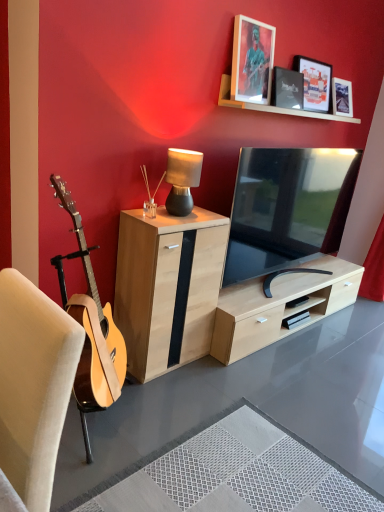
Question: Is natural wood cabinet at center spatially inside matte black picture frame at upper center, which appears as the third picture frame when viewed from the left, or outside of it?

Choices:
 (A) outside
 (B) inside

Answer: (A)

Question: Looking at their shapes, would you say natural wood cabinet at center is wider or thinner than matte black picture frame at upper center, which ranks as the 1th picture frame in right-to-left order?

Choices:
 (A) thin
 (B) wide

Answer: (B)

Question: Which is farther from the matte black tv at center?

Choices:
 (A) black matte picture frame at upper center, the 2th picture frame in the left-to-right sequence
 (B) metallic silver picture frame at upper center, the third picture frame in the right-to-left sequence
 (C) natural wood cabinet at center
 (D) white textured rug at lower center
 (E) matte black picture frame at upper center, which appears as the third picture frame when viewed from the left

Answer: (D)

Question: Which object is the closest to the matte black table lamp at center?

Choices:
 (A) matte black picture frame at upper center, which ranks as the 1th picture frame in right-to-left order
 (B) white textured rug at lower center
 (C) beige fabric chair at left
 (D) natural wood cabinet at center
 (E) matte black tv at center

Answer: (D)